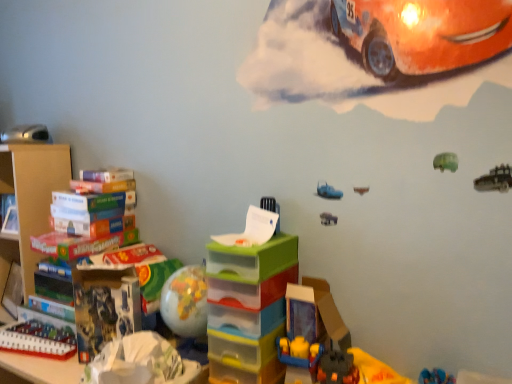
The width and height of the screenshot is (512, 384). I want to click on translucent plastic building blocks at lower left, which appears as the second toy when viewed from the left, so click(38, 340).

Find the location of a particular element. The height and width of the screenshot is (384, 512). cardboard at left is located at coordinates (30, 202).

Locate an element on the screen. translucent plastic toy at lower center, which appears as the first toy when viewed from the right is located at coordinates (315, 315).

Between cardboard at left and matte black toy car at left, which appears as the fourth toy when viewed from the right, which one appears on the left side from the viewer's perspective?

cardboard at left.

Considering the relative sizes of cardboard at left and matte black toy car at left, the 1th toy positioned from the left, in the image provided, is cardboard at left taller than matte black toy car at left, the 1th toy positioned from the left,?

Correct, cardboard at left is much taller as matte black toy car at left, the 1th toy positioned from the left.

Is cardboard at left located outside matte black toy car at left, the 1th toy positioned from the left?

cardboard at left is positioned outside matte black toy car at left, the 1th toy positioned from the left.

Does cardboard at left have a greater width compared to matte black toy car at left, which is the fourth toy from bottom to top?

Indeed, cardboard at left has a greater width compared to matte black toy car at left, which is the fourth toy from bottom to top.

Between translucent plastic toy at lower center, which appears as the first toy when viewed from the right, and matte black toy car at left, which is the fourth toy from bottom to top, which one appears on the left side from the viewer's perspective?

matte black toy car at left, which is the fourth toy from bottom to top, is more to the left.

Is translucent plastic toy at lower center, placed as the third toy when sorted from bottom to top, next to matte black toy car at left, the 1th toy positioned from the left, and touching it?

There is a gap between translucent plastic toy at lower center, placed as the third toy when sorted from bottom to top, and matte black toy car at left, the 1th toy positioned from the left.

Between translucent plastic toy at lower center, which is the fourth toy in left-to-right order, and matte black toy car at left, which appears as the fourth toy when viewed from the right, which one has larger size?

translucent plastic toy at lower center, which is the fourth toy in left-to-right order.

Considering the relative sizes of translucent plastic toy at lower center, which appears as the first toy when viewed from the right, and matte black toy car at left, the 1th toy positioned from the left, in the image provided, is translucent plastic toy at lower center, which appears as the first toy when viewed from the right, shorter than matte black toy car at left, the 1th toy positioned from the left,?

Incorrect, the height of translucent plastic toy at lower center, which appears as the first toy when viewed from the right, does not fall short of that of matte black toy car at left, the 1th toy positioned from the left.

From the image's perspective, is translucent plastic drawers at center, which is counted as the 2th toy, starting from the right, beneath translucent plastic toy at lower center, placed as the third toy when sorted from bottom to top?

Correct, translucent plastic drawers at center, which is counted as the 2th toy, starting from the right, appears lower than translucent plastic toy at lower center, placed as the third toy when sorted from bottom to top, in the image.

Between translucent plastic drawers at center, marked as the 2th toy in a bottom-to-top arrangement, and translucent plastic toy at lower center, the 2th toy from the top, which one appears on the right side from the viewer's perspective?

translucent plastic toy at lower center, the 2th toy from the top, is more to the right.

Who is taller, translucent plastic drawers at center, which is the 3th toy in left-to-right order, or translucent plastic toy at lower center, which is the fourth toy in left-to-right order?

With more height is translucent plastic drawers at center, which is the 3th toy in left-to-right order.

Could you measure the distance between translucent plastic drawers at center, the 3th toy from the top, and translucent plastic toy at lower center, which is the fourth toy in left-to-right order?

A distance of 4.54 inches exists between translucent plastic drawers at center, the 3th toy from the top, and translucent plastic toy at lower center, which is the fourth toy in left-to-right order.

Can you confirm if matte black toy car at left, the 1th toy positioned from the left, is smaller than cardboard at left?

Correct, matte black toy car at left, the 1th toy positioned from the left, occupies less space than cardboard at left.

Is matte black toy car at left, which is the 1th toy from top to bottom, to the right of cardboard at left from the viewer's perspective?

Correct, you'll find matte black toy car at left, which is the 1th toy from top to bottom, to the right of cardboard at left.

Relative to cardboard at left, is matte black toy car at left, which is the fourth toy from bottom to top, in front or behind?

Visually, matte black toy car at left, which is the fourth toy from bottom to top, is located behind cardboard at left.

Considering the positions of points (2, 142) and (37, 169), is point (2, 142) farther from camera compared to point (37, 169)?

Yes, point (2, 142) is behind point (37, 169).

From the image's perspective, starting from the translucent plastic toy at lower center, placed as the third toy when sorted from bottom to top, which toy is the 1st one below? Please provide its 2D coordinates.

[(248, 308)]

Considering the sizes of objects translucent plastic toy at lower center, the 2th toy from the top, and translucent plastic drawers at center, which is the 3th toy in left-to-right order, in the image provided, who is shorter, translucent plastic toy at lower center, the 2th toy from the top, or translucent plastic drawers at center, which is the 3th toy in left-to-right order,?

translucent plastic toy at lower center, the 2th toy from the top.

From a real-world perspective, is translucent plastic toy at lower center, the 2th toy from the top, positioned above or below translucent plastic drawers at center, the 3th toy from the top?

Clearly, from a real-world perspective, translucent plastic toy at lower center, the 2th toy from the top, is above translucent plastic drawers at center, the 3th toy from the top.

Is translucent plastic toy at lower center, placed as the third toy when sorted from bottom to top, situated inside translucent plastic drawers at center, the 3th toy from the top, or outside?

translucent plastic toy at lower center, placed as the third toy when sorted from bottom to top, is outside translucent plastic drawers at center, the 3th toy from the top.

Is translucent plastic toy at lower center, which is the fourth toy in left-to-right order, at the back of cardboard at left?

No, translucent plastic toy at lower center, which is the fourth toy in left-to-right order, is not at the back of cardboard at left.

Can you confirm if cardboard at left is bigger than translucent plastic toy at lower center, the 2th toy from the top?

Indeed, cardboard at left has a larger size compared to translucent plastic toy at lower center, the 2th toy from the top.

From a real-world perspective, who is located higher, cardboard at left or translucent plastic toy at lower center, which is the fourth toy in left-to-right order?

translucent plastic toy at lower center, which is the fourth toy in left-to-right order, from a real-world perspective.

Considering the relative sizes of cardboard at left and translucent plastic toy at lower center, which is the fourth toy in left-to-right order, in the image provided, is cardboard at left wider than translucent plastic toy at lower center, which is the fourth toy in left-to-right order,?

Indeed, cardboard at left has a greater width compared to translucent plastic toy at lower center, which is the fourth toy in left-to-right order.

Measure the distance from translucent plastic building blocks at lower left, the first toy from the bottom, to translucent plastic toy at lower center, which appears as the first toy when viewed from the right.

translucent plastic building blocks at lower left, the first toy from the bottom, is 31.61 inches from translucent plastic toy at lower center, which appears as the first toy when viewed from the right.

Can you confirm if translucent plastic building blocks at lower left, placed as the 3th toy when sorted from right to left, is wider than translucent plastic toy at lower center, which appears as the first toy when viewed from the right?

No.

Which is in front, translucent plastic building blocks at lower left, which appears as the 4th toy when viewed from the top, or translucent plastic toy at lower center, which appears as the first toy when viewed from the right?

translucent plastic toy at lower center, which appears as the first toy when viewed from the right.

Based on the photo, which of these two, translucent plastic building blocks at lower left, which appears as the 4th toy when viewed from the top, or translucent plastic toy at lower center, the 2th toy from the top, stands taller?

Standing taller between the two is translucent plastic toy at lower center, the 2th toy from the top.

There is a cardboard at left. At what (x,y) coordinates should I click in order to perform the action: click on the 3rd toy above it (from the image's perspective). Please return your answer as a coordinate pair (x, y). The height and width of the screenshot is (384, 512). Looking at the image, I should click on (26, 134).

Where is `the 3rd toy to the left of the translucent plastic toy at lower center, which is the fourth toy in left-to-right order, counting from the anchor's position`? This screenshot has height=384, width=512. the 3rd toy to the left of the translucent plastic toy at lower center, which is the fourth toy in left-to-right order, counting from the anchor's position is located at coordinates (26, 134).

Estimate the real-world distances between objects in this image. Which object is closer to translucent plastic toy at lower center, which appears as the first toy when viewed from the right, translucent plastic building blocks at lower left, which appears as the second toy when viewed from the left, or translucent plastic drawers at center, which is the 3th toy in left-to-right order?

Among the two, translucent plastic drawers at center, which is the 3th toy in left-to-right order, is located nearer to translucent plastic toy at lower center, which appears as the first toy when viewed from the right.

When comparing their distances from cardboard at left, does translucent plastic toy at lower center, which appears as the first toy when viewed from the right, or translucent plastic building blocks at lower left, placed as the 3th toy when sorted from right to left, seem closer?

Based on the image, translucent plastic building blocks at lower left, placed as the 3th toy when sorted from right to left, appears to be nearer to cardboard at left.

From the image, which object appears to be farther from translucent plastic drawers at center, marked as the 2th toy in a bottom-to-top arrangement, translucent plastic building blocks at lower left, which appears as the 4th toy when viewed from the top, or matte black toy car at left, which appears as the fourth toy when viewed from the right?

matte black toy car at left, which appears as the fourth toy when viewed from the right, is further to translucent plastic drawers at center, marked as the 2th toy in a bottom-to-top arrangement.

Considering their positions, is translucent plastic building blocks at lower left, the first toy from the bottom, positioned further to translucent plastic drawers at center, which is counted as the 2th toy, starting from the right, than cardboard at left?

cardboard at left lies further to translucent plastic drawers at center, which is counted as the 2th toy, starting from the right, than the other object.

Which object lies further to the anchor point cardboard at left, translucent plastic toy at lower center, which appears as the first toy when viewed from the right, or matte black toy car at left, which appears as the fourth toy when viewed from the right?

Based on the image, translucent plastic toy at lower center, which appears as the first toy when viewed from the right, appears to be further to cardboard at left.

From the picture: Looking at the image, which one is located further to cardboard at left, matte black toy car at left, which appears as the fourth toy when viewed from the right, or translucent plastic toy at lower center, the 2th toy from the top?

The object further to cardboard at left is translucent plastic toy at lower center, the 2th toy from the top.

Considering their positions, is translucent plastic toy at lower center, placed as the third toy when sorted from bottom to top, positioned closer to translucent plastic drawers at center, the 3th toy from the top, than matte black toy car at left, which is the fourth toy from bottom to top?

Based on the image, translucent plastic toy at lower center, placed as the third toy when sorted from bottom to top, appears to be nearer to translucent plastic drawers at center, the 3th toy from the top.

Considering their positions, is translucent plastic building blocks at lower left, which appears as the second toy when viewed from the left, positioned closer to cardboard at left than matte black toy car at left, the 1th toy positioned from the left?

matte black toy car at left, the 1th toy positioned from the left.

You are a GUI agent. You are given a task and a screenshot of the screen. Output one action in this format:
    pyautogui.click(x=<x>, y=<y>)
    Task: Click on the shelf between matte black toy car at left, which is the 1th toy from top to bottom, and translucent plastic building blocks at lower left, the first toy from the bottom, in the vertical direction
    This screenshot has height=384, width=512.
    Given the screenshot: What is the action you would take?
    pyautogui.click(x=30, y=202)

Identify the location of toy between matte black toy car at left, which is the 1th toy from top to bottom, and translucent plastic drawers at center, marked as the 2th toy in a bottom-to-top arrangement, from left to right. (38, 340).

This screenshot has width=512, height=384. I want to click on toy between translucent plastic building blocks at lower left, which appears as the second toy when viewed from the left, and translucent plastic toy at lower center, which appears as the first toy when viewed from the right, so click(248, 308).